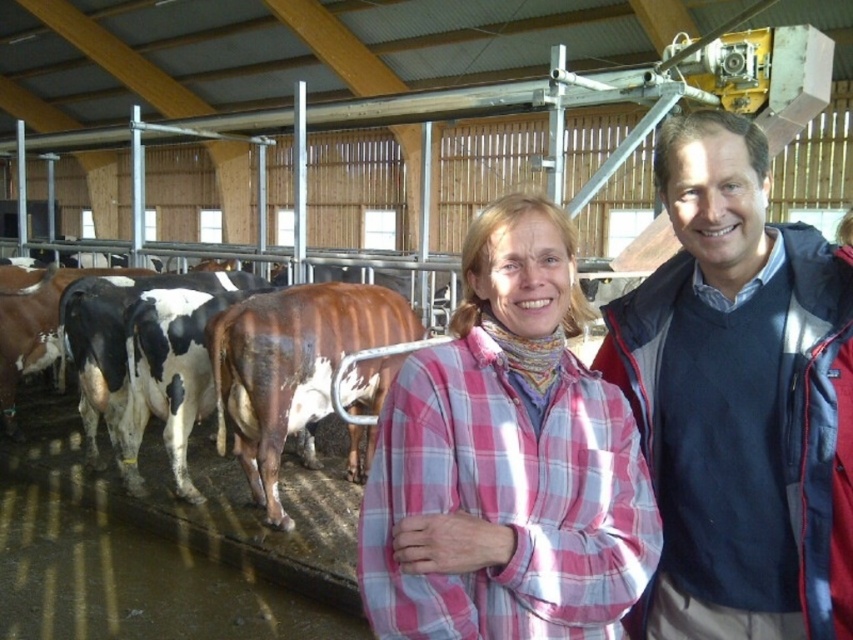
You are a photographer trying to capture a closeup of the dark blue sweater at center. The camera you are using has a focal length of 50mm and a sensor size of 24mm x 36mm. What is the minimum distance you need to stand from the subject to fill the frame with the sweater?

To determine the minimum distance required, we can use the formula for calculating the minimum focus distance needed to fill the frame. The formula is Distance equals sensor dimension divided by twice the focal length multiplied by the subject size. However, since the sweater is at a specific coordinate point, the exact distance would depend on the sweater dimensions and its position relative to the camera. Without additional information about the sweater size or the camera angle, an exact calculation isn

You are standing in the barn and want to place a small potted plant between the two points labeled point (732, 296) and point (604, 541). Since the points are at different distances from you, which point should the plant be closer to in order to appear centered from your viewpoint?

The plant should be placed closer to point (604, 541) because point (732, 296) is further away from you. This way, the plant will appear centered between the two points from your perspective.

You are a photographer trying to capture both the dark blue sweater at center and the pink plaid shirt at center in a single shot. Since you want to ensure both are fully visible, which clothing item should you focus on first to avoid blurring due to their size differences?

The dark blue sweater at center is thinner than the pink plaid shirt at center, so you should focus on the pink plaid shirt at center first as it is larger and might require more precise focusing to ensure clarity.